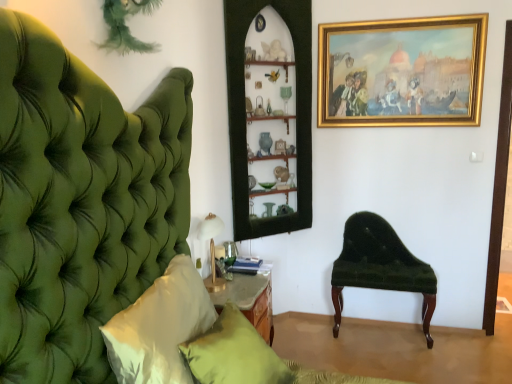
Question: Would you say gold metallic table lamp at lower left is outside velvet green bench at right?

Choices:
 (A) no
 (B) yes

Answer: (B)

Question: Is gold metallic table lamp at lower left facing away from velvet green bench at right?

Choices:
 (A) yes
 (B) no

Answer: (B)

Question: Considering the relative sizes of gold metallic table lamp at lower left and velvet green bench at right in the image provided, is gold metallic table lamp at lower left thinner than velvet green bench at right?

Choices:
 (A) no
 (B) yes

Answer: (B)

Question: Considering the relative sizes of gold metallic table lamp at lower left and velvet green bench at right in the image provided, is gold metallic table lamp at lower left wider than velvet green bench at right?

Choices:
 (A) yes
 (B) no

Answer: (B)

Question: Can you confirm if gold metallic table lamp at lower left is positioned to the left of velvet green bench at right?

Choices:
 (A) yes
 (B) no

Answer: (A)

Question: From a real-world perspective, is gold metallic table lamp at lower left located beneath velvet green bench at right?

Choices:
 (A) no
 (B) yes

Answer: (A)

Question: Would you say gold metallic table lamp at lower left contains white satin pillow at left, the 1th pillow viewed from the front?

Choices:
 (A) yes
 (B) no

Answer: (B)

Question: Is gold metallic table lamp at lower left located outside white satin pillow at left, the 1th pillow viewed from the front?

Choices:
 (A) no
 (B) yes

Answer: (B)

Question: From a real-world perspective, is gold metallic table lamp at lower left below white satin pillow at left, which is the second pillow from back to front?

Choices:
 (A) yes
 (B) no

Answer: (B)

Question: Can you confirm if gold metallic table lamp at lower left is positioned to the left of white satin pillow at left, the 1th pillow viewed from the front?

Choices:
 (A) no
 (B) yes

Answer: (A)

Question: Could you tell me if gold metallic table lamp at lower left is facing white satin pillow at left, which is the second pillow from back to front?

Choices:
 (A) no
 (B) yes

Answer: (A)

Question: From the image's perspective, is gold metallic table lamp at lower left over white satin pillow at left, the 1th pillow viewed from the front?

Choices:
 (A) no
 (B) yes

Answer: (B)

Question: Is white satin pillow at left, which is the second pillow from back to front, directly adjacent to gold metallic table lamp at lower left?

Choices:
 (A) yes
 (B) no

Answer: (B)